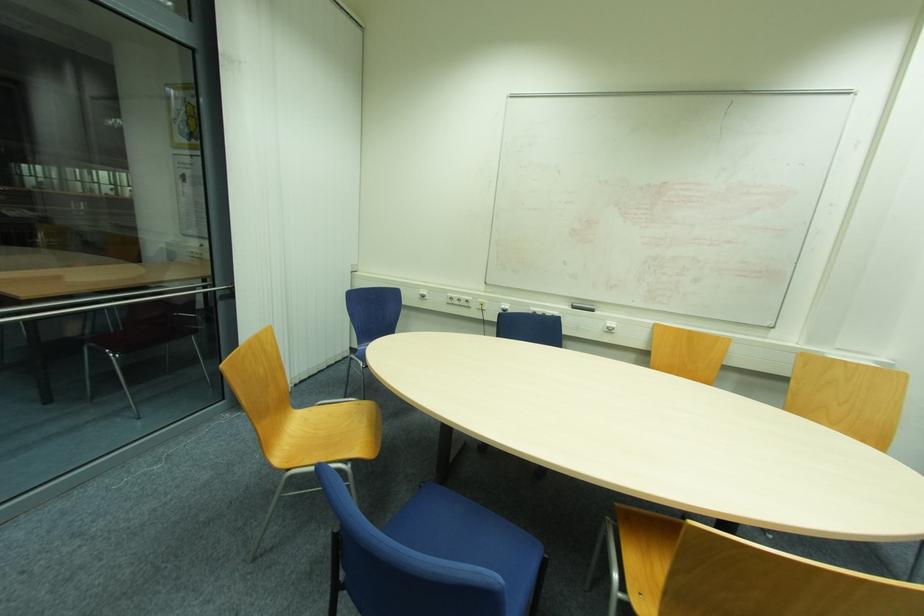
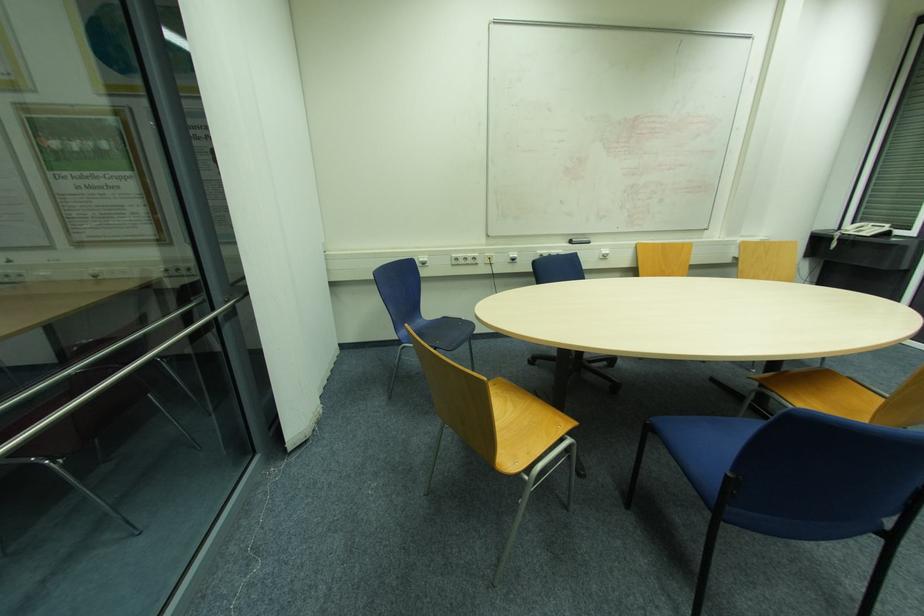
Where in the second image is the point corresponding to (610,325) from the first image?

(604, 253)